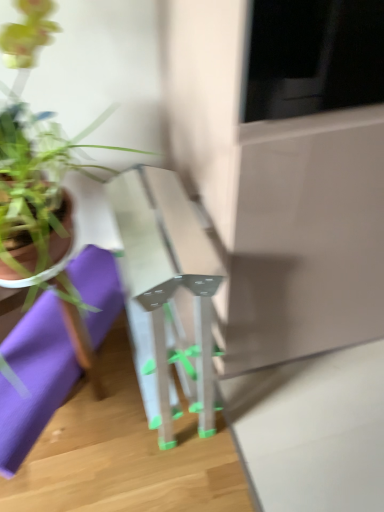
Image resolution: width=384 pixels, height=512 pixels. Identify the location of free space in front of transparent plastic table at center. (173, 455).